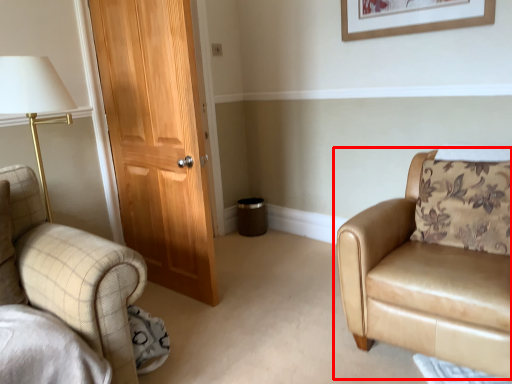
Question: In this image, where is chair (annotated by the red box) located relative to picture frame?

Choices:
 (A) right
 (B) left

Answer: (A)